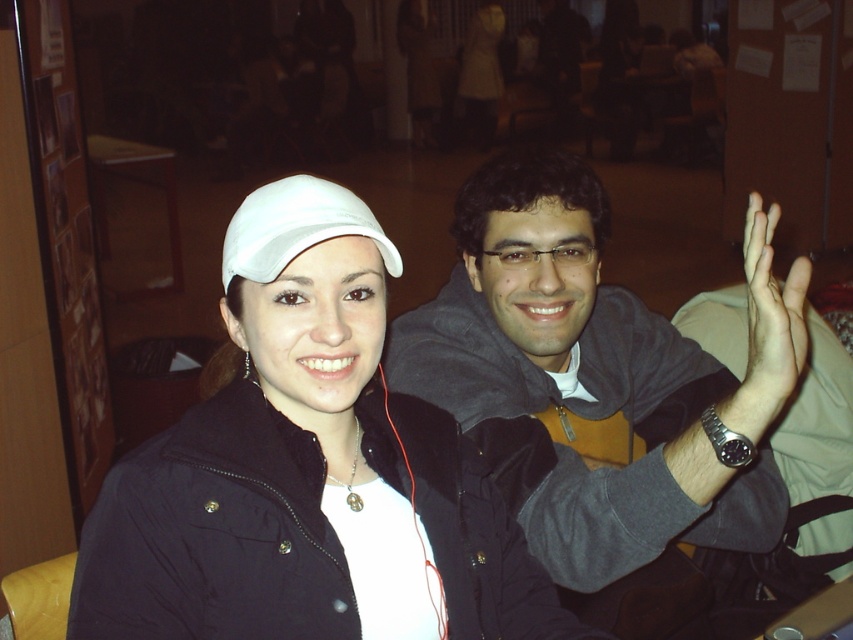
You are a photographer trying to capture the interaction between the two people in the scene. You want to ensure that both the matte gray hoodie at center and the matte skin hand at upper right are clearly visible in your shot. Based on their positions, which object is closer to the camera?

The matte skin hand at upper right is closer to the camera because it is positioned above the matte gray hoodie at center, indicating it is in a more forward spatial plane.

In the scene shown: You are planning to wear both the white matte cap at upper left and the matte gray hoodie at center. Which one do you need to put on first according to their heights?

The white matte cap at upper left is not as tall as the matte gray hoodie at center, so you should put on the matte gray hoodie at center first and then the white matte cap at upper left to avoid having to adjust them afterward.